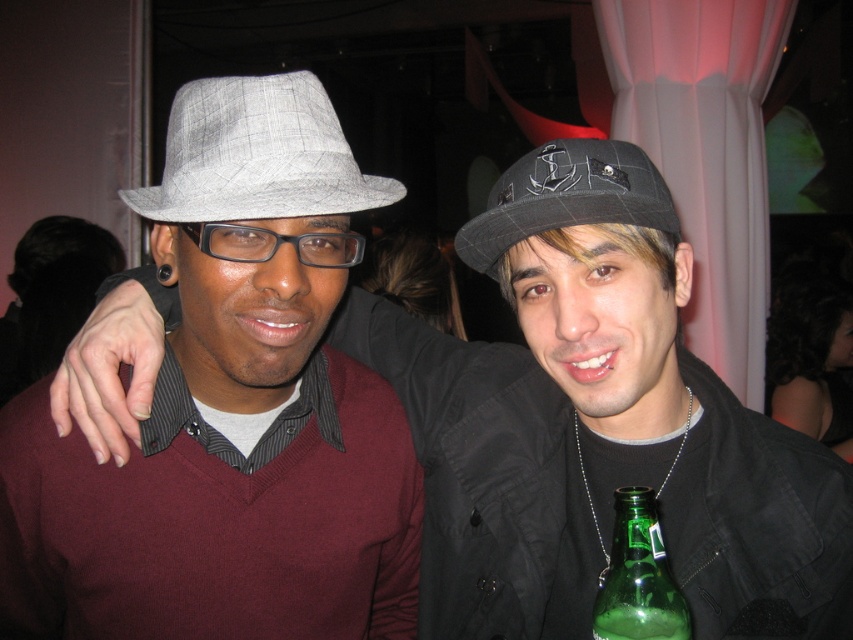
You are a photographer adjusting camera settings for a portrait. You notice two hats in the frame. The matte gray hat at center and the gray plaid fedora at upper left. Which hat should you focus on if you want to capture the tallest hat in the scene?

The matte gray hat at center is much taller than the gray plaid fedora at upper left, so you should focus on the matte gray hat at center to capture the tallest hat in the scene.

You are a photographer adjusting the camera focus. You notice two fedoras in the frame. The gray plaid fedora at upper left and the plaid fabric fedora at center. Which one is closer to the camera?

The gray plaid fedora at upper left has a lesser height compared to the plaid fabric fedora at center, so it is closer to the camera.

You are a photographer adjusting your camera focus. You notice two points in the image at coordinates point (593, 467) and point (613, 554). Which point should you focus on first if you want to ensure the closer object is sharp?

Point (593, 467) is closer to the viewer than point (613, 554), so you should focus on point (593, 467) first to ensure the closer object is sharp.